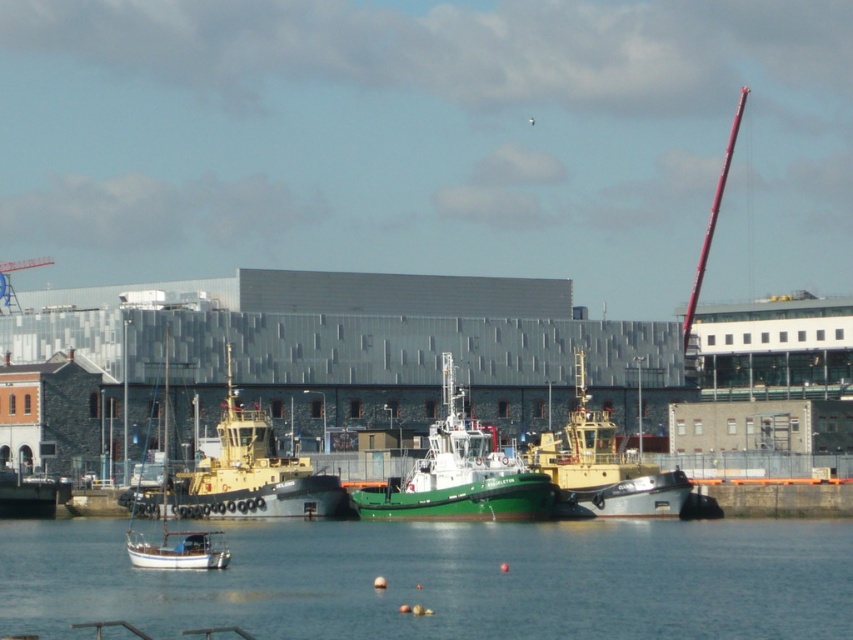
You are a photographer planning to capture a shot of the metallic yellow tugboat at center and the smooth red pole at upper right. Which object will appear taller in the photograph?

The smooth red pole at upper right is taller than the metallic yellow tugboat at center, so it will appear taller in the photograph.

You are standing at the waterfront looking out at the harbor. There are two points marked in the image, one at coordinates point [334,480] and the other at point [741,109]. Which point is nearer to your viewpoint?

Point [334,480] is closer to the camera than point [741,109], so the point at coordinates point [334,480] is nearer to your viewpoint.

You are a harbor worker who needs to secure the metallic yellow tugboat at center and the white matte sailboat at center. Since they are docked close together, which boat should you secure first to prevent them from drifting apart?

The metallic yellow tugboat at center should be secured first because it is positioned over the white matte sailboat at center, meaning it is closer to the dock and less likely to drift away.